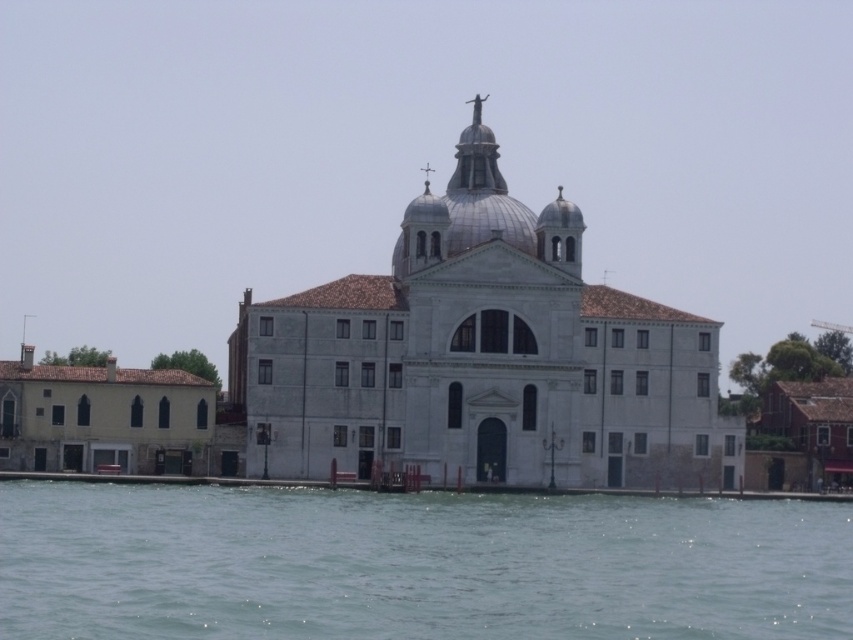
Can you confirm if white stone church at center is wider than yellow matte building at left?

Yes.

Does point (380, 429) lie behind point (114, 467)?

That is True.

At what (x,y) coordinates should I click in order to perform the action: click on white stone church at center. Please return your answer as a coordinate pair (x, y). This screenshot has width=853, height=640. Looking at the image, I should click on (482, 356).

Does clear water at lower center have a smaller size compared to white stone church at center?

Indeed, clear water at lower center has a smaller size compared to white stone church at center.

Which is more to the right, clear water at lower center or white stone church at center?

clear water at lower center

What do you see at coordinates (415, 564) in the screenshot?
I see `clear water at lower center` at bounding box center [415, 564].

Find the location of a particular element. The width and height of the screenshot is (853, 640). clear water at lower center is located at coordinates (415, 564).

Can you confirm if clear water at lower center is positioned above yellow matte building at left?

No.

What do you see at coordinates (415, 564) in the screenshot?
I see `clear water at lower center` at bounding box center [415, 564].

Is point (149, 637) closer to camera compared to point (126, 374)?

Yes, point (149, 637) is in front of point (126, 374).

At what (x,y) coordinates should I click in order to perform the action: click on clear water at lower center. Please return your answer as a coordinate pair (x, y). Looking at the image, I should click on (415, 564).